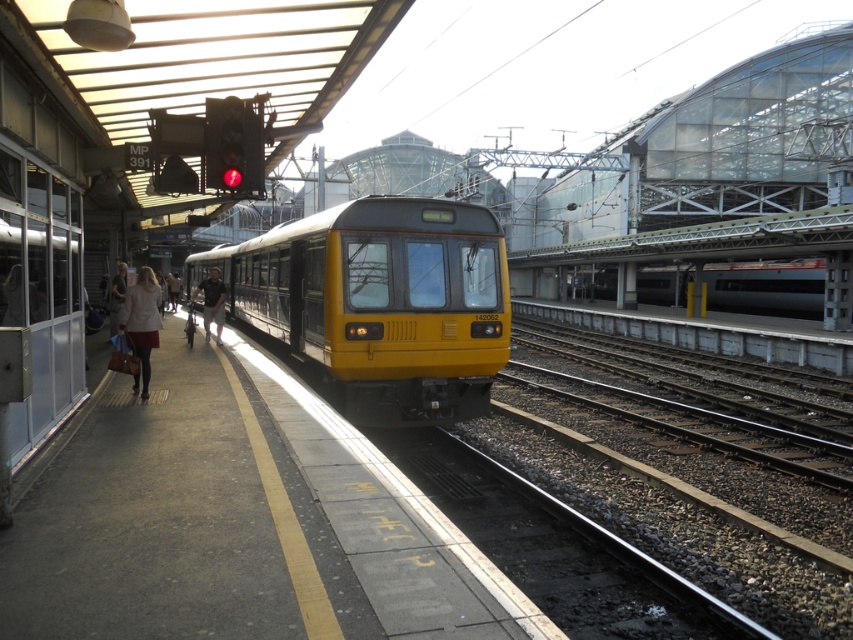
Locate an element on the screen. The height and width of the screenshot is (640, 853). yellow matte train at center is located at coordinates (380, 301).

Can you confirm if yellow matte train at center is smaller than silver metallic train at center?

Actually, yellow matte train at center might be larger than silver metallic train at center.

Which is more to the right, yellow matte train at center or silver metallic train at center?

From the viewer's perspective, silver metallic train at center appears more on the right side.

Locate an element on the screen. The image size is (853, 640). yellow matte train at center is located at coordinates (380, 301).

Locate an element on the screen. This screenshot has height=640, width=853. yellow matte train at center is located at coordinates (380, 301).

Who is higher up, yellow matte train at center or dark gray pants at left?

yellow matte train at center is higher up.

Where is `yellow matte train at center`? yellow matte train at center is located at coordinates (380, 301).